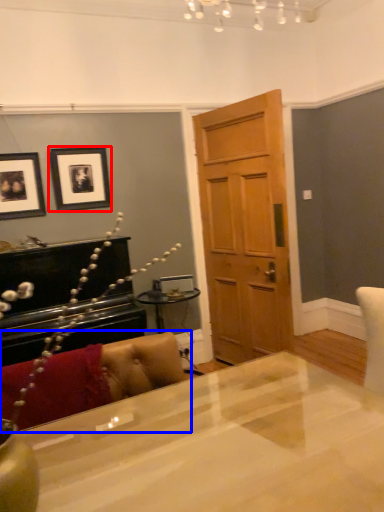
Question: Which point is further to the camera, picture frame (highlighted by a red box) or couch (highlighted by a blue box)?

Choices:
 (A) picture frame
 (B) couch

Answer: (A)